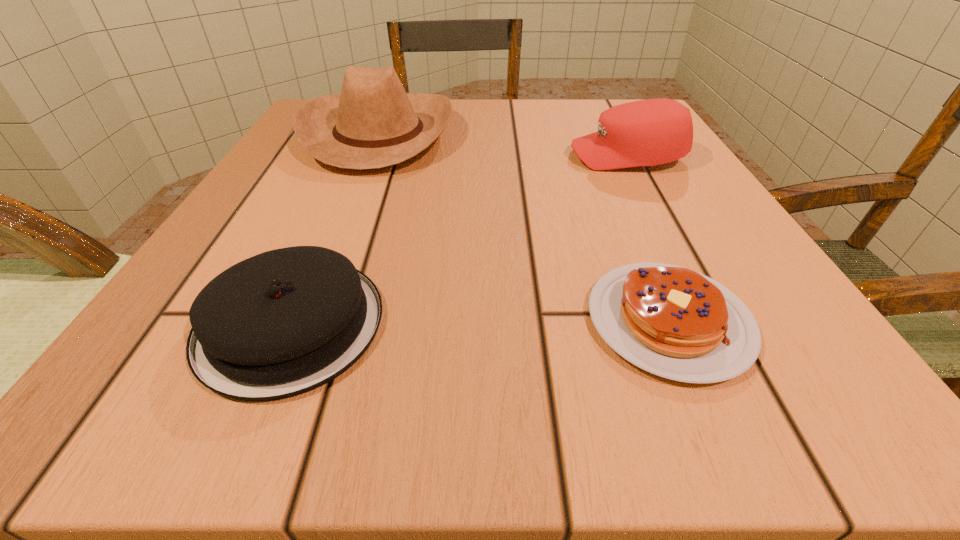
In order to click on unoccupied area between the cap and the taller pancake in this screenshot , I will do `click(459, 240)`.

Identify the location of free point between the cap and the cowboy hat. (503, 145).

This screenshot has width=960, height=540. Find the location of `free area in between the left pancake and the third shortest object`. free area in between the left pancake and the third shortest object is located at coordinates (459, 240).

Where is `free spot between the third tallest object and the tallest object`? free spot between the third tallest object and the tallest object is located at coordinates 335,229.

Locate an element on the screen. This screenshot has width=960, height=540. unoccupied area between the taller pancake and the second tallest object is located at coordinates (459, 240).

At what (x,y) coordinates should I click in order to perform the action: click on vacant area that lies between the tallest object and the third tallest object. Please return your answer as a coordinate pair (x, y). The width and height of the screenshot is (960, 540). Looking at the image, I should click on (335, 229).

You are a GUI agent. You are given a task and a screenshot of the screen. Output one action in this format:
    pyautogui.click(x=<x>, y=<y>)
    Task: Click on the vacant area between the taller pancake and the cowboy hat
    
    Given the screenshot: What is the action you would take?
    pyautogui.click(x=335, y=229)

Select which object is the closest to the cap. Please provide its 2D coordinates. Your answer should be formatted as a tuple, i.e. [(x, y)], where the tuple contains the x and y coordinates of a point satisfying the conditions above.

[(373, 123)]

Select which object is the second closest to the right pancake. Please provide its 2D coordinates. Your answer should be formatted as a tuple, i.e. [(x, y)], where the tuple contains the x and y coordinates of a point satisfying the conditions above.

[(650, 132)]

At what (x,y) coordinates should I click in order to perform the action: click on blank area in the image that satisfies the following two spatial constraints: 1. on the front-facing side of the cowboy hat; 2. on the left side of the shorter pancake. Please return your answer as a coordinate pair (x, y). Looking at the image, I should click on (305, 321).